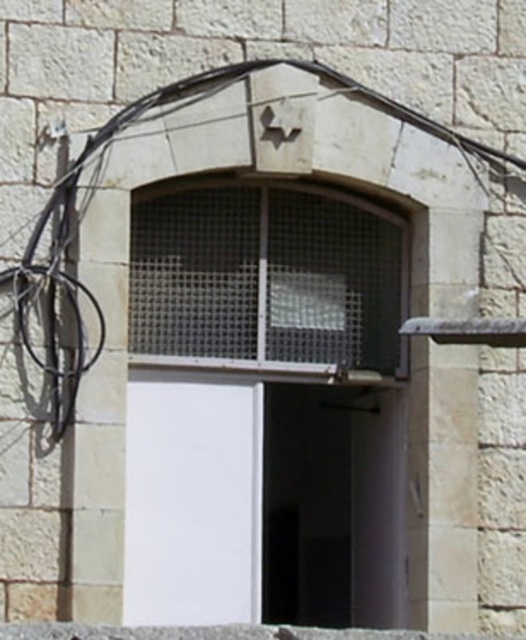
Between metal mesh window at center and black rubber wire at upper left, which one is positioned lower?

Positioned lower is metal mesh window at center.

Based on the photo, who is higher up, metal mesh window at center or black rubber wire at upper left?

Positioned higher is black rubber wire at upper left.

What are the coordinates of `metal mesh window at center` in the screenshot? It's located at (266, 276).

Between metal mesh window at center and smooth concrete ledge at lower center, which one appears on the right side from the viewer's perspective?

Positioned to the right is metal mesh window at center.

Can you confirm if metal mesh window at center is positioned above smooth concrete ledge at lower center?

Yes, metal mesh window at center is above smooth concrete ledge at lower center.

I want to click on metal mesh window at center, so click(266, 276).

What are the coordinates of `metal mesh window at center` in the screenshot? It's located at (266, 276).

Between black rubber wire at upper left and smooth concrete ledge at lower center, which one is positioned lower?

smooth concrete ledge at lower center is below.

Who is shorter, black rubber wire at upper left or smooth concrete ledge at lower center?

smooth concrete ledge at lower center is shorter.

The height and width of the screenshot is (640, 526). In order to click on black rubber wire at upper left in this screenshot , I will do `click(96, 188)`.

Locate an element on the screen. The width and height of the screenshot is (526, 640). black rubber wire at upper left is located at coordinates (96, 188).